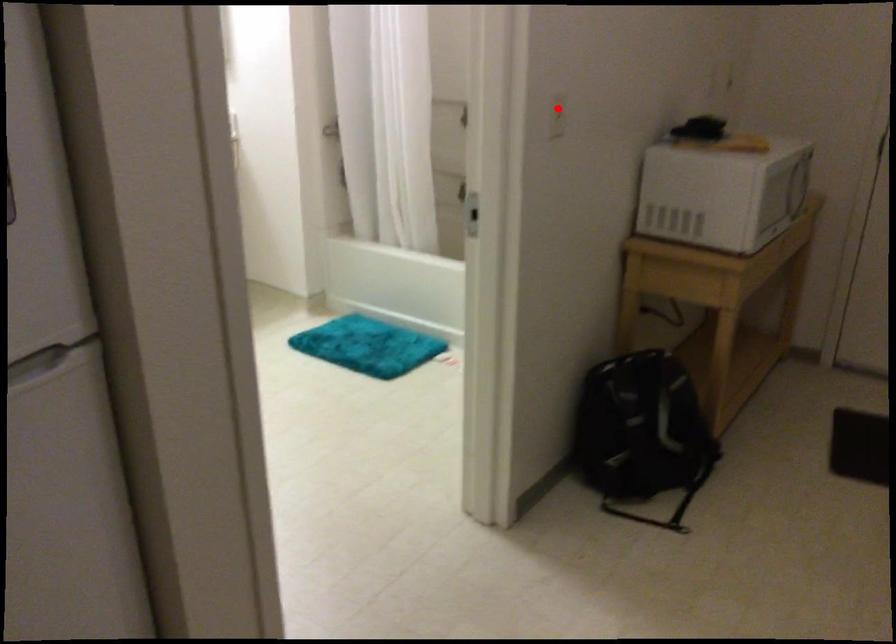
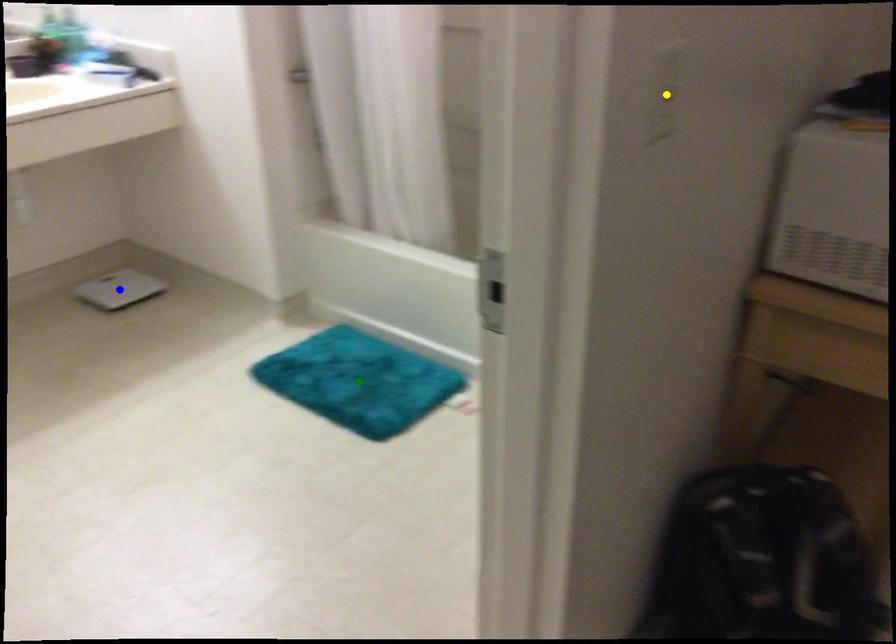
Question: I am providing you with two images of the same scene from different viewpoints. A red point is marked on the first image. You are given multiple points on the second image. In image 2, which mark is for the same physical point as the one in image 1?

Choices:
 (A) blue point
 (B) green point
 (C) yellow point

Answer: (C)